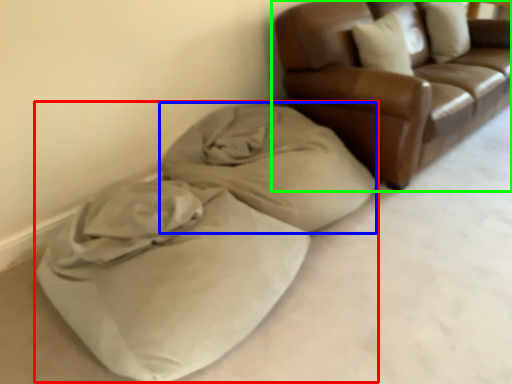
Question: Which is farther away from bean bag chair (highlighted by a red box)? blanket (highlighted by a blue box) or studio couch (highlighted by a green box)?

Choices:
 (A) blanket
 (B) studio couch

Answer: (B)